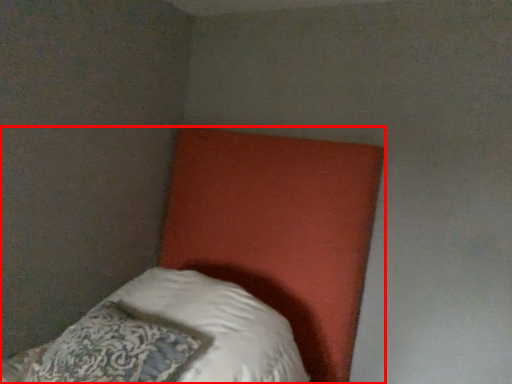
Question: From the image's perspective, where is bed (annotated by the red box) located in relation to pillow in the image?

Choices:
 (A) below
 (B) above

Answer: (B)